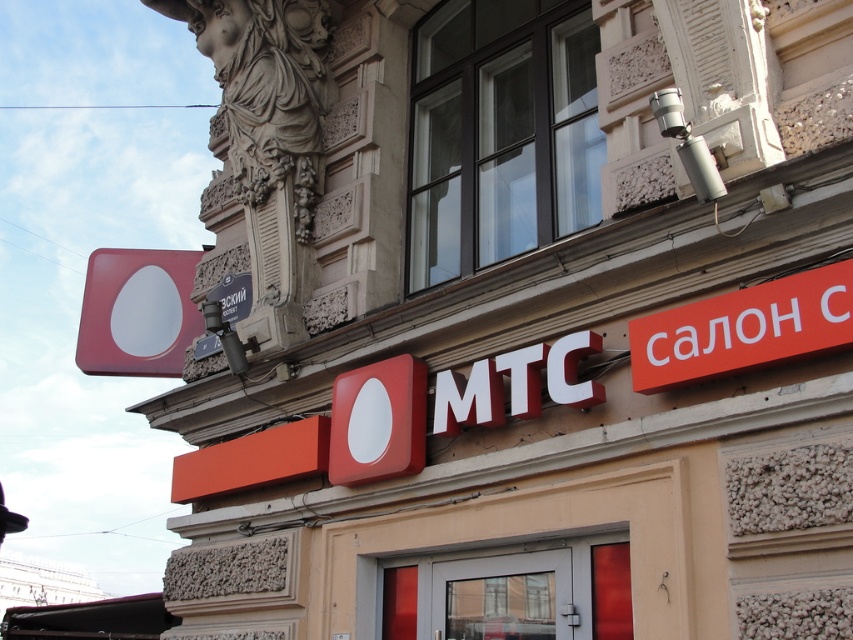
Question: Is orange matte sign at upper right above metallic gray sign at upper center?

Choices:
 (A) yes
 (B) no

Answer: (B)

Question: Which point is farther from the camera taking this photo?

Choices:
 (A) (141, 340)
 (B) (633, 388)

Answer: (A)

Question: Which point is closer to the camera?

Choices:
 (A) metallic gray sign at upper center
 (B) orange matte sign at upper right

Answer: (B)

Question: Which point is closer to the camera?

Choices:
 (A) (796, 285)
 (B) (225, 292)
 (C) (177, 269)

Answer: (A)

Question: Can you confirm if matte red sign at upper left is wider than metallic gray sign at upper center?

Choices:
 (A) no
 (B) yes

Answer: (B)

Question: Does matte red sign at upper left appear on the right side of metallic gray sign at upper center?

Choices:
 (A) yes
 (B) no

Answer: (B)